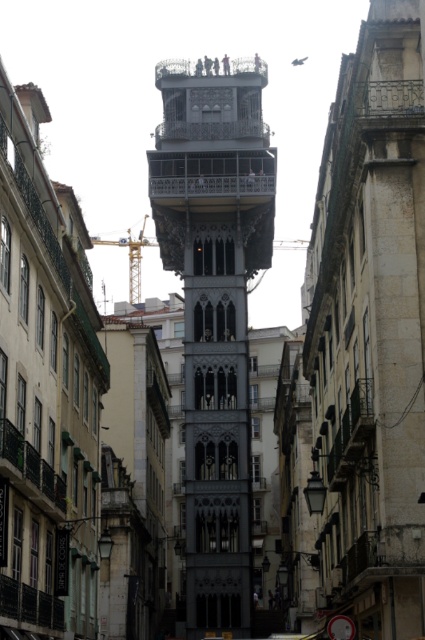
You are a tourist standing on the narrow urban street and want to take a photo of both the gray stone bell tower at center and the yellow metallic crane at center. Which object should you focus on first to ensure both are in the frame?

You should focus on the gray stone bell tower at center first because it is closer to you than the yellow metallic crane at center, so adjusting the camera to include it will naturally include the crane in the background as well.

You are a city planner assessing the urban layout of this historic street. Given that the gray stone bell tower at center and the yellow metallic crane at center are 298.83 feet apart, would a new pedestrian walkway of 300 feet in length be sufficient to connect both landmarks without any detours?

The gray stone bell tower at center and the yellow metallic crane at center are 298.83 feet apart. A 300 feet pedestrian walkway would be sufficient to connect both landmarks without detours as it is slightly longer than the distance between them.